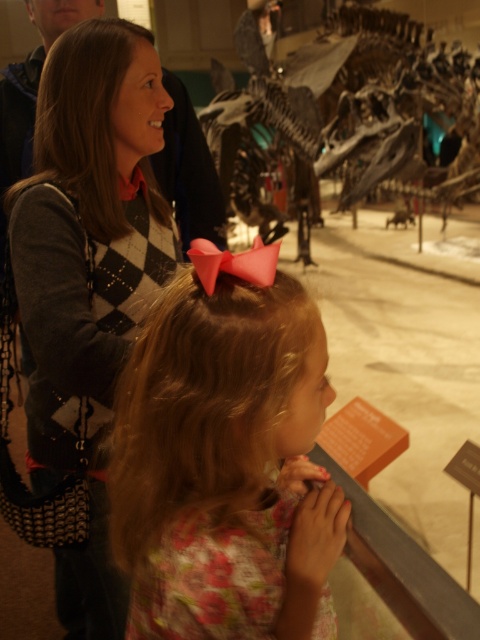
Question: Which is farther from the pink satin bow at center?

Choices:
 (A) argyle sweater at upper left
 (B) shiny metallic dinosaur at center

Answer: (B)

Question: Is pink satin bow at center positioned behind shiny metallic dinosaur at center?

Choices:
 (A) no
 (B) yes

Answer: (A)

Question: Is pink satin bow at center positioned in front of shiny metallic dinosaur at center?

Choices:
 (A) yes
 (B) no

Answer: (A)

Question: Can you confirm if pink satin bow at center is bigger than argyle sweater at upper left?

Choices:
 (A) no
 (B) yes

Answer: (A)

Question: Which point appears closest to the camera in this image?

Choices:
 (A) (98, 115)
 (B) (307, 349)

Answer: (B)

Question: Which point appears closest to the camera in this image?

Choices:
 (A) (115, 269)
 (B) (279, 84)
 (C) (173, 524)

Answer: (C)